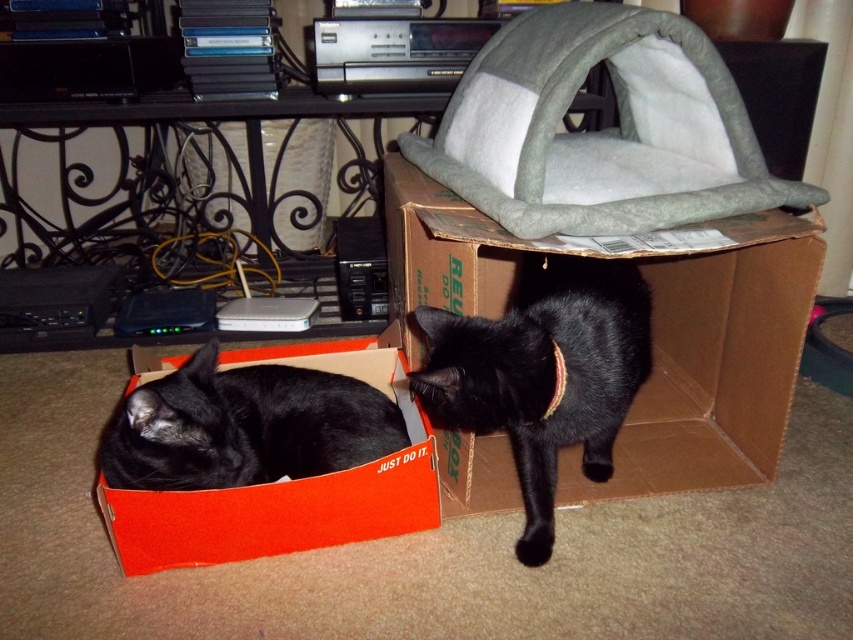
I want to click on cardboard box at center, so click(715, 364).

Does point (674, 317) come behind point (233, 428)?

Yes, point (674, 317) is farther from viewer.

Is point (737, 276) closer to viewer compared to point (309, 378)?

No, (737, 276) is behind (309, 378).

Image resolution: width=853 pixels, height=640 pixels. Find the location of `cardboard box at center`. cardboard box at center is located at coordinates (715, 364).

Does cardboard box at center have a greater height compared to black fur cat at center?

Yes, cardboard box at center is taller than black fur cat at center.

Between point (798, 321) and point (566, 422), which one is positioned behind?

The point (798, 321) is behind.

Does point (738, 442) lie in front of point (544, 502)?

That is False.

The width and height of the screenshot is (853, 640). Find the location of `cardboard box at center`. cardboard box at center is located at coordinates (715, 364).

Based on the photo, can you confirm if black fur cat at center is positioned above black smooth cat at lower left?

Yes, black fur cat at center is above black smooth cat at lower left.

Does point (554, 337) lie behind point (265, 435)?

That is False.

Where is `black fur cat at center`? Image resolution: width=853 pixels, height=640 pixels. black fur cat at center is located at coordinates (543, 372).

I want to click on black fur cat at center, so click(x=543, y=372).